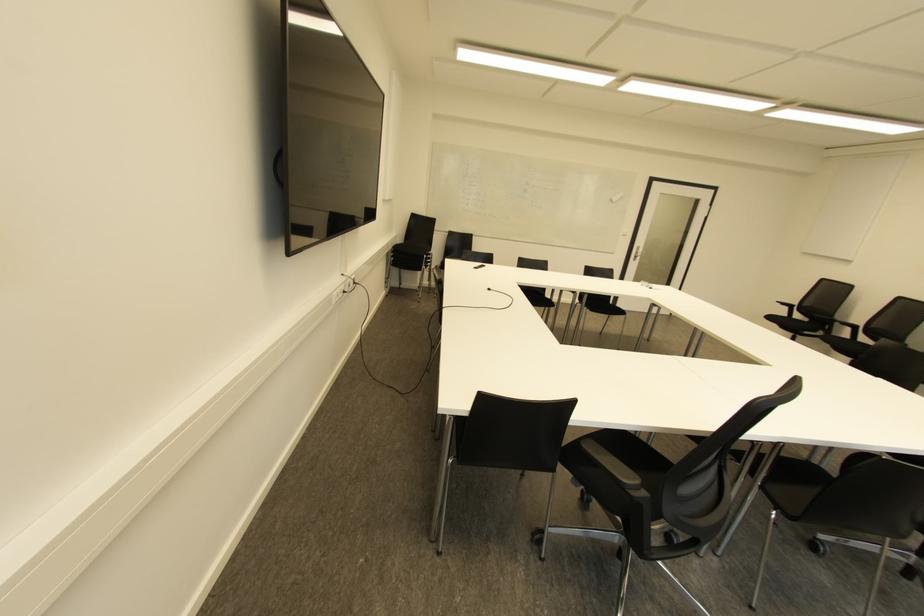
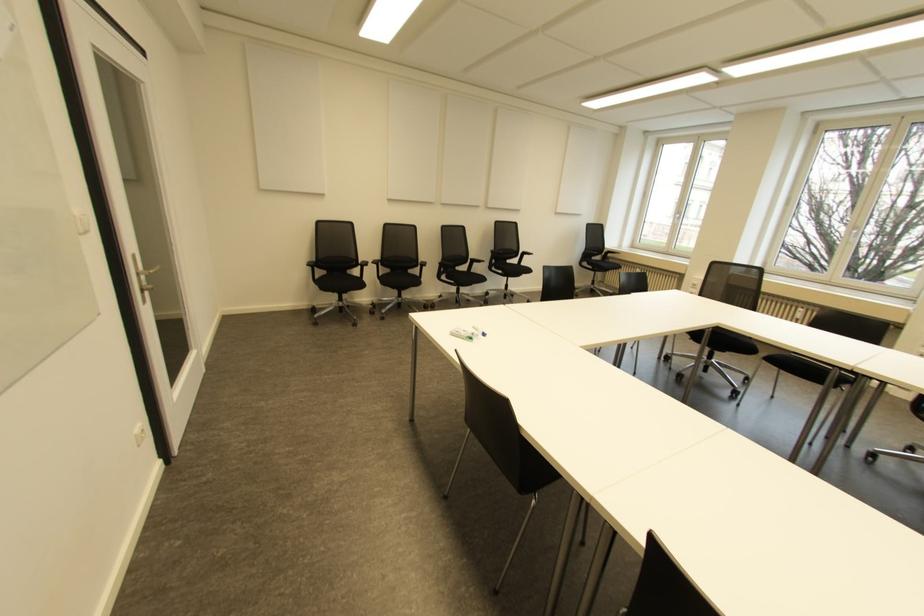
Find the pixel in the second image that matches (785,307) in the first image.

(310, 268)